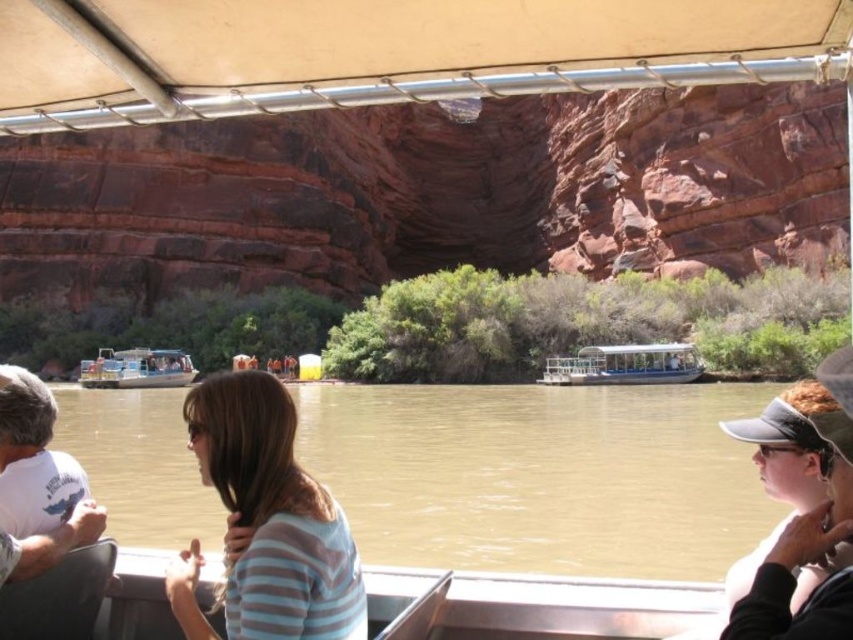
Question: Is matte black visor at lower right thinner than white plastic boat at center?

Choices:
 (A) no
 (B) yes

Answer: (B)

Question: Does brown matte water at center appear under matte black visor at lower right?

Choices:
 (A) yes
 (B) no

Answer: (A)

Question: Can you confirm if white plastic boat at center is bigger than white plastic boat at left?

Choices:
 (A) no
 (B) yes

Answer: (A)

Question: Among these points, which one is nearest to the camera?

Choices:
 (A) (689, 344)
 (B) (346, 49)

Answer: (B)

Question: Estimate the real-world distances between objects in this image. Which object is closer to the matte beige canopy at upper center?

Choices:
 (A) brown matte water at center
 (B) white plastic boat at left
 (C) striped fabric shirt at center

Answer: (C)

Question: Which of the following is the farthest from the observer?

Choices:
 (A) striped fabric shirt at center
 (B) matte black visor at lower right
 (C) white plastic boat at left

Answer: (C)